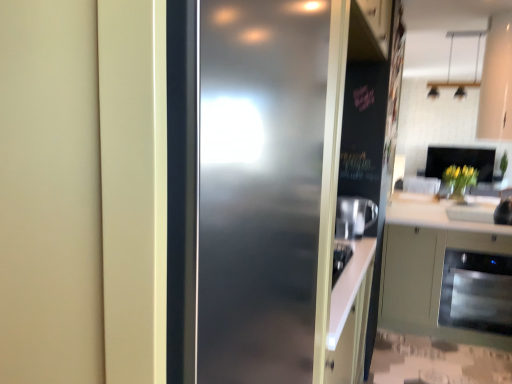
Question: Is sleek stainless steel dishwasher at lower right not close to matte white door at center?

Choices:
 (A) no
 (B) yes

Answer: (B)

Question: From a real-world perspective, is sleek stainless steel dishwasher at lower right under matte white door at center?

Choices:
 (A) yes
 (B) no

Answer: (A)

Question: Can you confirm if sleek stainless steel dishwasher at lower right is bigger than matte white door at center?

Choices:
 (A) yes
 (B) no

Answer: (B)

Question: Is sleek stainless steel dishwasher at lower right shorter than matte white door at center?

Choices:
 (A) yes
 (B) no

Answer: (A)

Question: Is sleek stainless steel dishwasher at lower right further to the viewer compared to matte white door at center?

Choices:
 (A) yes
 (B) no

Answer: (A)

Question: Is sleek stainless steel dishwasher at lower right bigger or smaller than white glossy sink at lower right?

Choices:
 (A) big
 (B) small

Answer: (A)

Question: Considering their positions, is sleek stainless steel dishwasher at lower right located in front of or behind white glossy sink at lower right?

Choices:
 (A) front
 (B) behind

Answer: (A)

Question: Is point (489, 284) positioned closer to the camera than point (504, 200)?

Choices:
 (A) closer
 (B) farther

Answer: (A)

Question: Is sleek stainless steel dishwasher at lower right taller or shorter than white glossy sink at lower right?

Choices:
 (A) short
 (B) tall

Answer: (B)

Question: Looking at the image, does sleek stainless steel dishwasher at lower right seem bigger or smaller compared to matte green cabinet at lower right?

Choices:
 (A) big
 (B) small

Answer: (B)

Question: From the image's perspective, relative to matte green cabinet at lower right, is sleek stainless steel dishwasher at lower right above or below?

Choices:
 (A) above
 (B) below

Answer: (B)

Question: Does point (510, 296) appear closer or farther from the camera than point (485, 238)?

Choices:
 (A) farther
 (B) closer

Answer: (A)

Question: Is sleek stainless steel dishwasher at lower right inside the boundaries of matte green cabinet at lower right, or outside?

Choices:
 (A) outside
 (B) inside

Answer: (B)

Question: Considering the positions of matte green cabinet at lower right and white glossy sink at lower right in the image, is matte green cabinet at lower right taller or shorter than white glossy sink at lower right?

Choices:
 (A) short
 (B) tall

Answer: (B)

Question: Looking at their shapes, would you say matte green cabinet at lower right is wider or thinner than white glossy sink at lower right?

Choices:
 (A) wide
 (B) thin

Answer: (A)